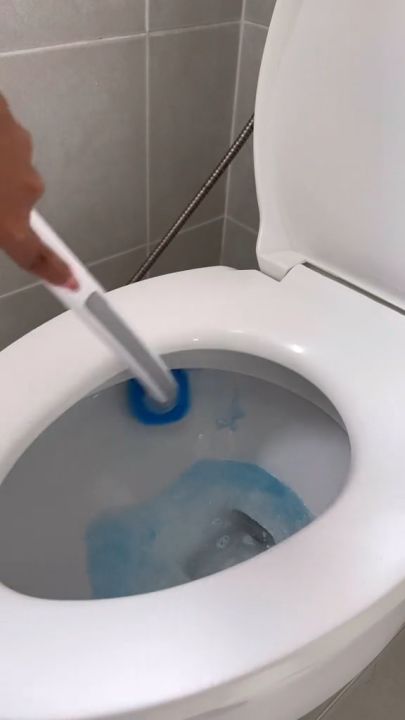
You are a GUI agent. You are given a task and a screenshot of the screen. Output one action in this format:
    pyautogui.click(x=<x>, y=<y>)
    Task: Click on the entry
    The height and width of the screenshot is (720, 405).
    Given the screenshot: What is the action you would take?
    pyautogui.click(x=242, y=533)